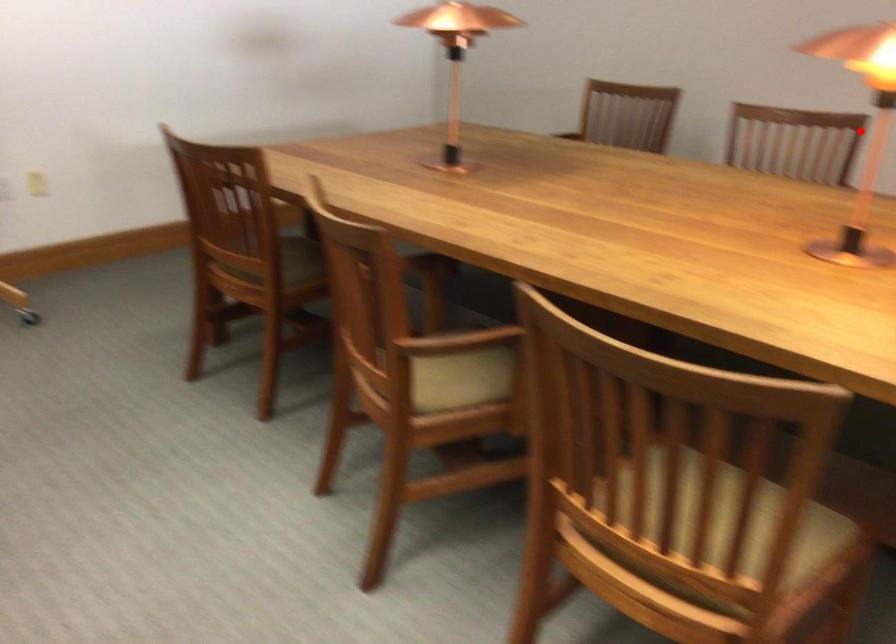
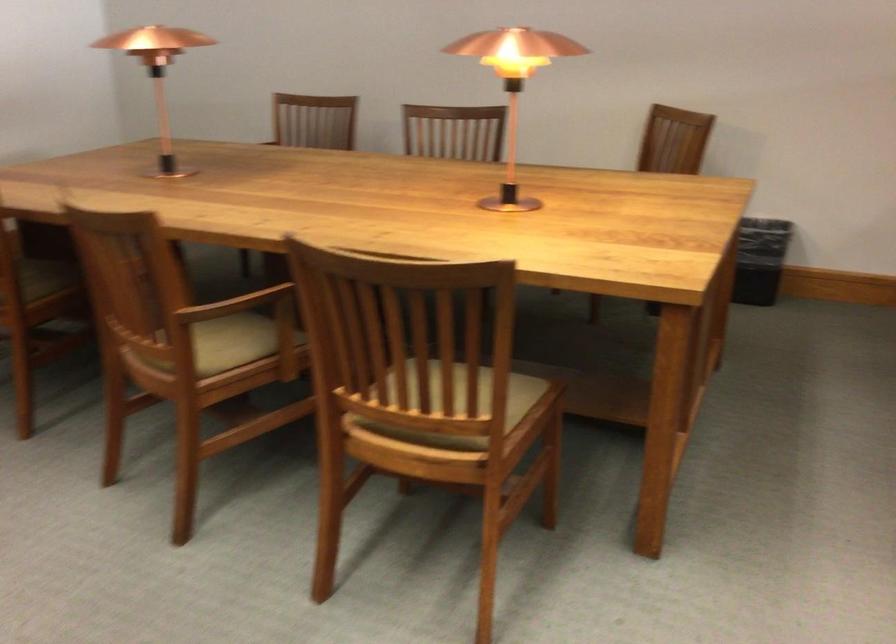
The point at the highlighted location is marked in the first image. Where is the corresponding point in the second image?

(502, 120)